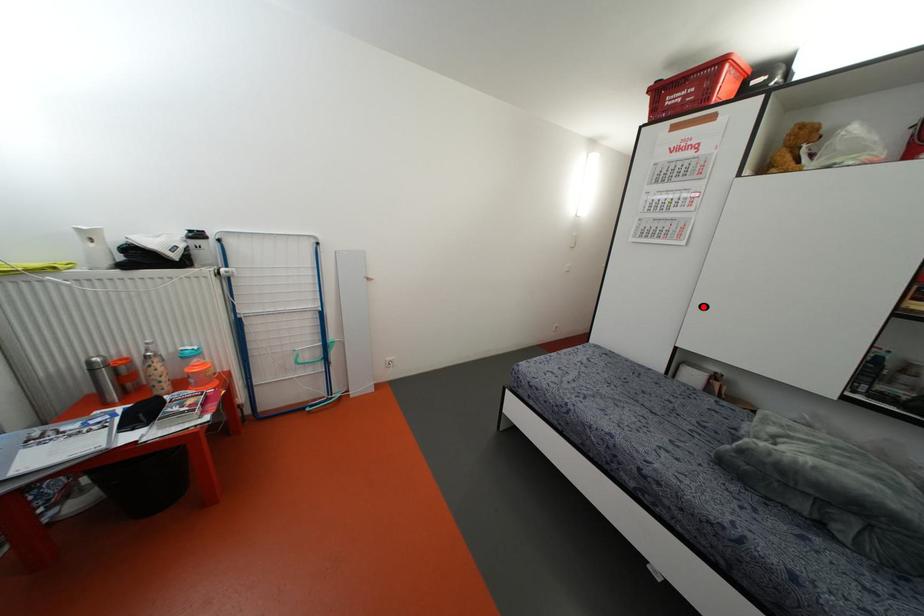
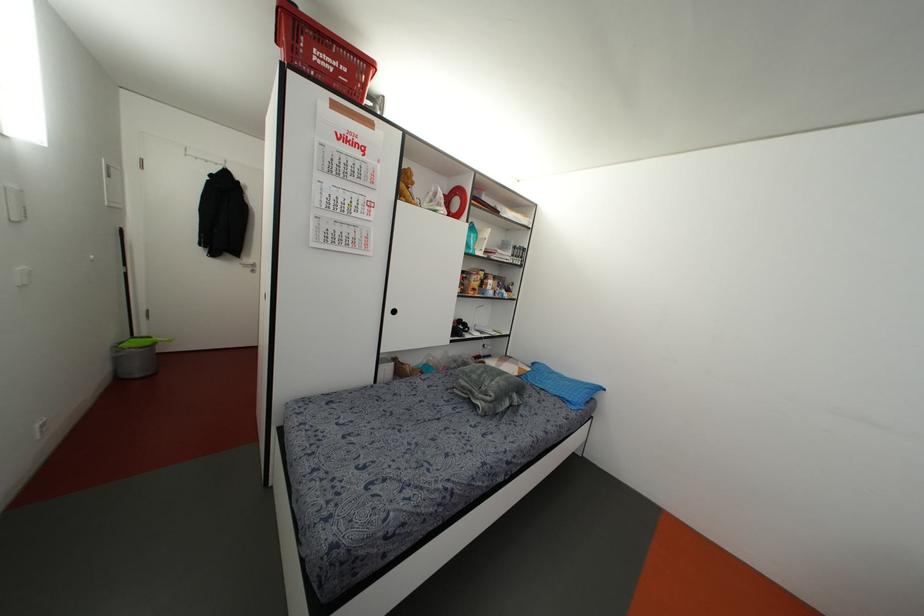
Question: I am providing you with two images of the same scene from different viewpoints. A red point is marked on the first image. Is the red point's position out of view in image 2?

Choices:
 (A) Yes
 (B) No

Answer: (B)